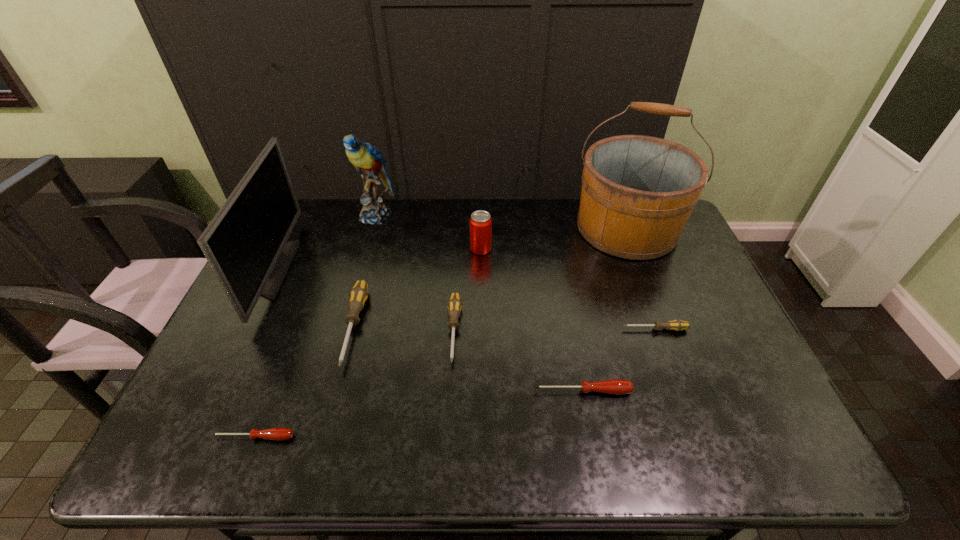
The image size is (960, 540). I want to click on the farther red screwdriver, so click(613, 386).

Find the location of a particular element. This screenshot has height=540, width=960. the second nearest screwdriver is located at coordinates (613, 386).

At what (x,y) coordinates should I click in order to perform the action: click on the smallest gray screwdriver. Please return your answer as a coordinate pair (x, y). Looking at the image, I should click on (677, 325).

The height and width of the screenshot is (540, 960). Find the location of `the rightmost screwdriver`. the rightmost screwdriver is located at coordinates tap(677, 325).

The height and width of the screenshot is (540, 960). In order to click on the leftmost screwdriver in this screenshot , I will do `click(278, 434)`.

Where is `the nearest screwdriver`? the nearest screwdriver is located at coordinates (278, 434).

Where is `free space located 0.070m on the left of the bucket`? Image resolution: width=960 pixels, height=540 pixels. free space located 0.070m on the left of the bucket is located at coordinates (554, 228).

I want to click on vacant region located 0.250m on the face of the parrot, so click(357, 279).

Locate an element on the screen. This screenshot has width=960, height=540. vacant space located 0.060m on the screen side of the monitor is located at coordinates (307, 269).

Locate an element on the screen. This screenshot has height=540, width=960. free space located on the front of the fourth object from right to left is located at coordinates (481, 314).